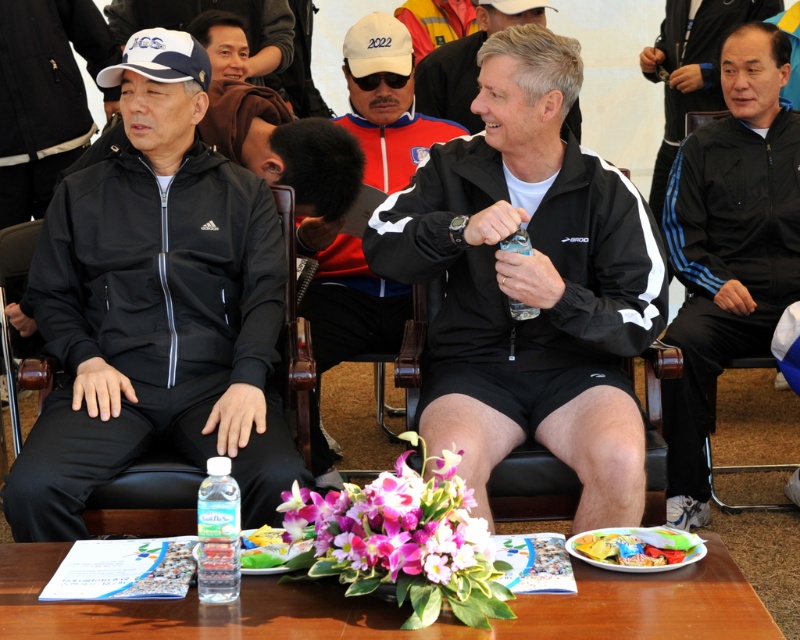
You are a photographer positioned behind the table. You need to capture a photo that includes both the gray matte jacket at center and the clear plastic bottle at center. Which object will appear closer to the camera in the photo?

The gray matte jacket at center will appear closer to the camera in the photo because it is positioned further to the viewer than the clear plastic bottle at center.

You are standing in front of the table and want to reach both the point at coordinates point (440,234) and the point at coordinates point (482,26). Which point will you reach first?

The point at coordinates point (440,234) is closer to you than the point at coordinates point (482,26), so you will reach the point at coordinates point (440,234) first.